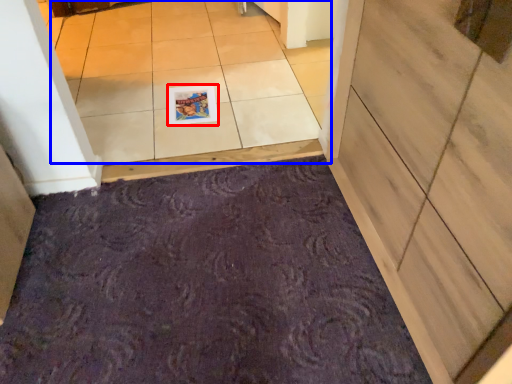
Question: Which object appears closest to the camera in this image, postcard (highlighted by a red box) or tile (highlighted by a blue box)?

Choices:
 (A) postcard
 (B) tile

Answer: (B)